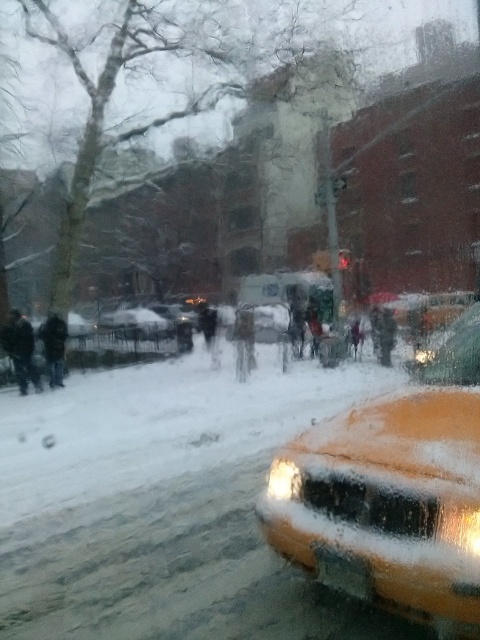
Which of these two, dark brown leather jacket at left or dark gray coat at center, stands shorter?

With less height is dark brown leather jacket at left.

Does dark brown leather jacket at left have a greater width compared to dark gray coat at center?

No.

What are the coordinates of `dark brown leather jacket at left` in the screenshot? It's located at (21, 349).

Can you confirm if orange matte taxi at lower right is positioned to the left of dark gray fabric coat at center?

No, orange matte taxi at lower right is not to the left of dark gray fabric coat at center.

Identify the location of orange matte taxi at lower right. (392, 497).

I want to click on orange matte taxi at lower right, so click(x=392, y=497).

Does snow-covered sedan at center appear over dark brown fur coat at center?

Correct, snow-covered sedan at center is located above dark brown fur coat at center.

Consider the image. Is snow-covered sedan at center smaller than dark brown fur coat at center?

Actually, snow-covered sedan at center might be larger than dark brown fur coat at center.

Does point (115, 337) lie in front of point (59, 353)?

That is False.

In order to click on snow-covered sedan at center in this screenshot , I will do `click(149, 321)`.